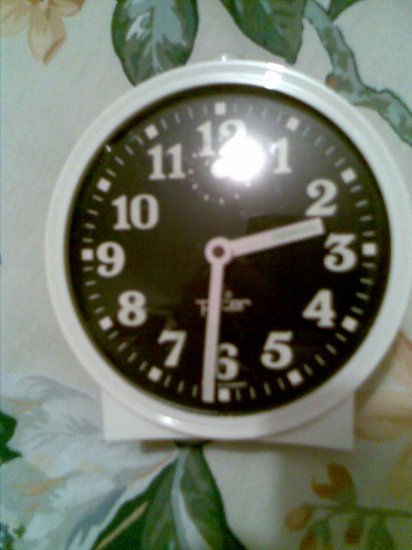
Image resolution: width=412 pixels, height=550 pixels. What are the coordinates of `longer clock arm` in the screenshot? It's located at (210, 359).